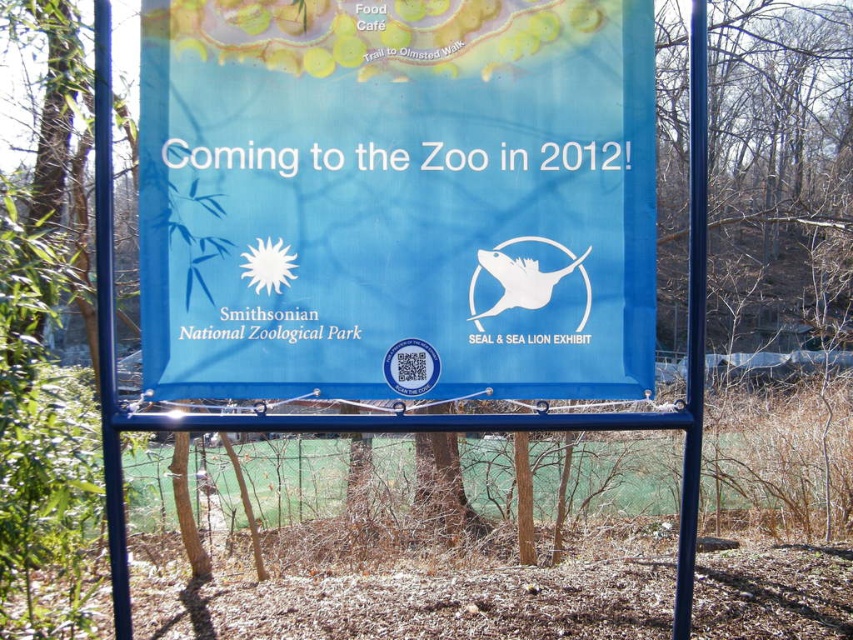
Which of these two, blue metallic pole at right or blue metallic pole at left, stands taller?

Standing taller between the two is blue metallic pole at left.

Between point (689, 300) and point (109, 394), which one is positioned behind?

The point (689, 300) is more distant.

Where is `blue metallic pole at right`? This screenshot has width=853, height=640. blue metallic pole at right is located at coordinates (693, 323).

Can you confirm if blue fabric sign at center is bigger than blue metallic pole at left?

Yes, blue fabric sign at center is bigger than blue metallic pole at left.

This screenshot has height=640, width=853. What do you see at coordinates (396, 196) in the screenshot? I see `blue fabric sign at center` at bounding box center [396, 196].

Identify the location of blue fabric sign at center. (396, 196).

Looking at this image, who is positioned more to the left, blue fabric sign at center or blue metallic pole at right?

From the viewer's perspective, blue fabric sign at center appears more on the left side.

Looking at this image, can you confirm if blue fabric sign at center is bigger than blue metallic pole at right?

Correct, blue fabric sign at center is larger in size than blue metallic pole at right.

Who is more distant from viewer, (630,1) or (699,211)?

Point (699,211)

Locate an element on the screen. blue fabric sign at center is located at coordinates (396, 196).